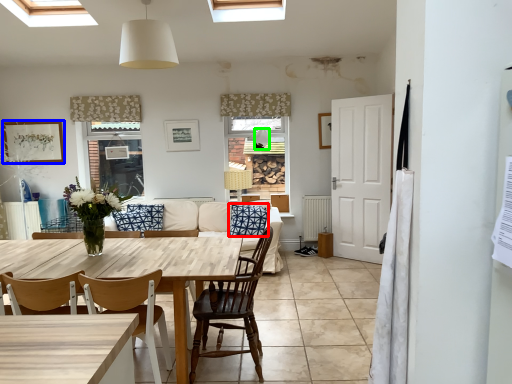
Question: Which object is the farthest from pillow (highlighted by a red box)? Choose among these: picture frame (highlighted by a blue box) or lamp (highlighted by a green box).

Choices:
 (A) picture frame
 (B) lamp

Answer: (A)